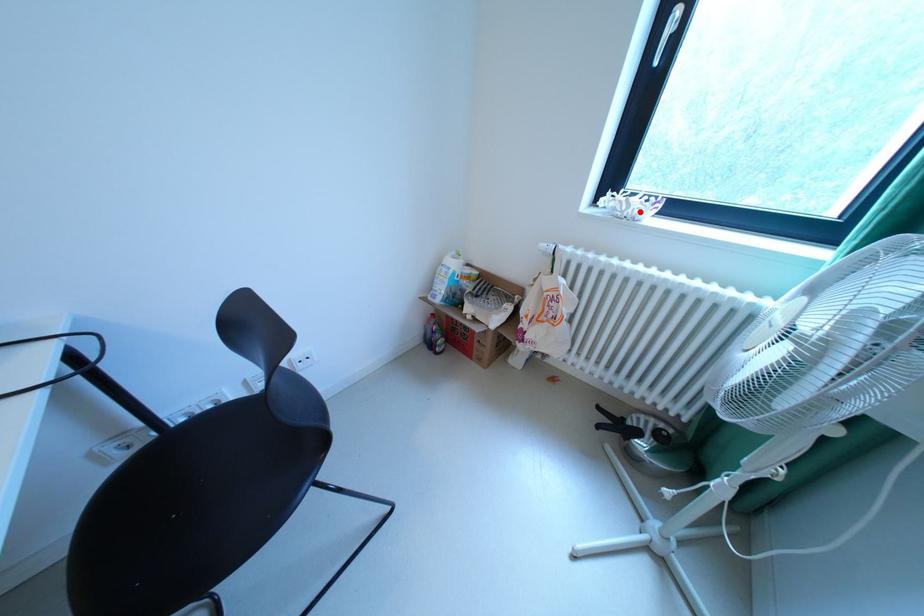
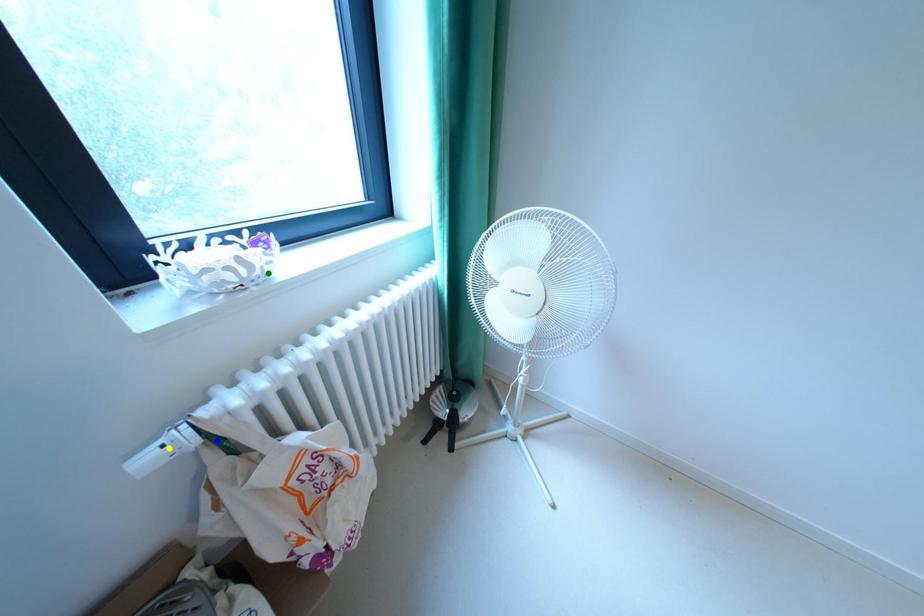
Question: I am providing you with two images of the same scene from different viewpoints. A red point is marked on the first image. You are given multiple points on the second image. Which mark in image 2 goes with the point in image 1?

Choices:
 (A) yellow point
 (B) blue point
 (C) green point

Answer: (C)